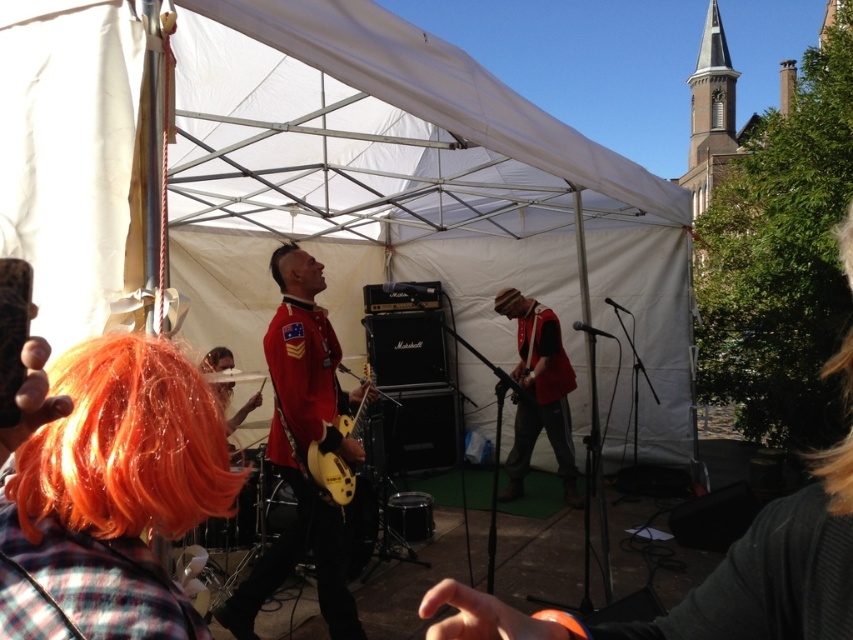
You are a photographer at the event and want to capture a photo that includes both the matte red vest at center and dark brown hair at center. Based on their positions, which one should you focus on first to ensure both are in the frame?

The matte red vest at center is positioned under dark brown hair at center, so you should focus on the dark brown hair at center first to ensure both are in the frame.

You are a photographer at the event and need to capture a close shot of the shiny red uniform at center. You have a camera that can focus up to 10 feet. Can you take the photo from where you are standing without moving closer?

The shiny red uniform at center and camera are 12.60 feet apart from each other. Since the camera can only focus up to 10 feet, you cannot take the photo without moving closer.